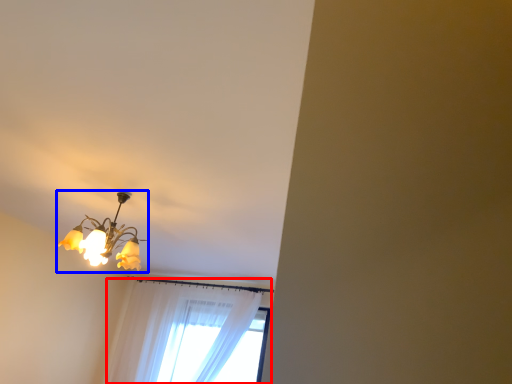
Question: Among these objects, which one is nearest to the camera, curtain (highlighted by a red box) or lamp (highlighted by a blue box)?

Choices:
 (A) curtain
 (B) lamp

Answer: (B)